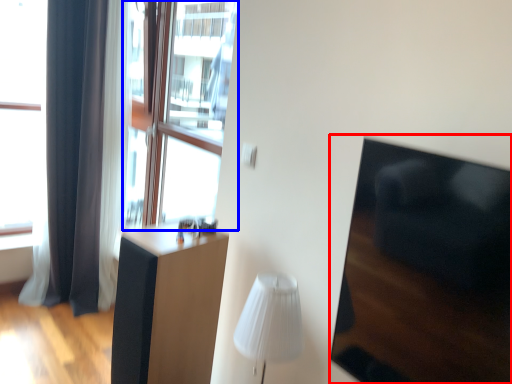
Question: Which point is closer to the camera, armchair (highlighted by a red box) or window screen (highlighted by a blue box)?

Choices:
 (A) armchair
 (B) window screen

Answer: (A)